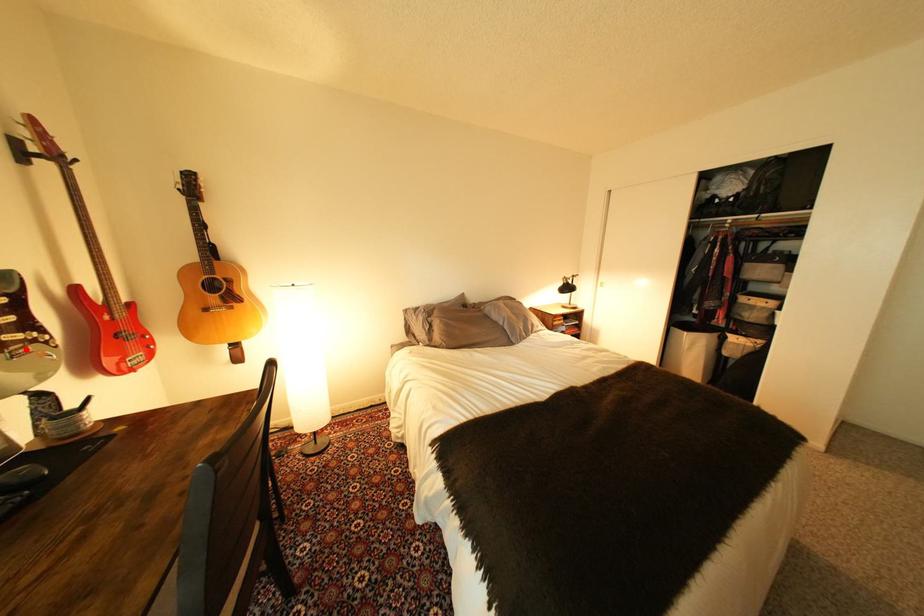
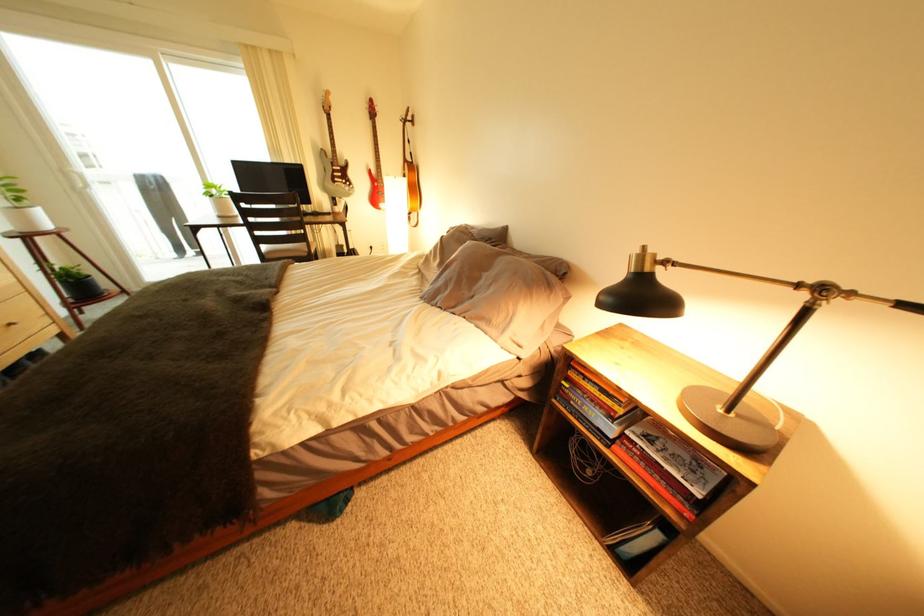
In the second image, find the point that corresponds to the highlighted location in the first image.

(349, 185)